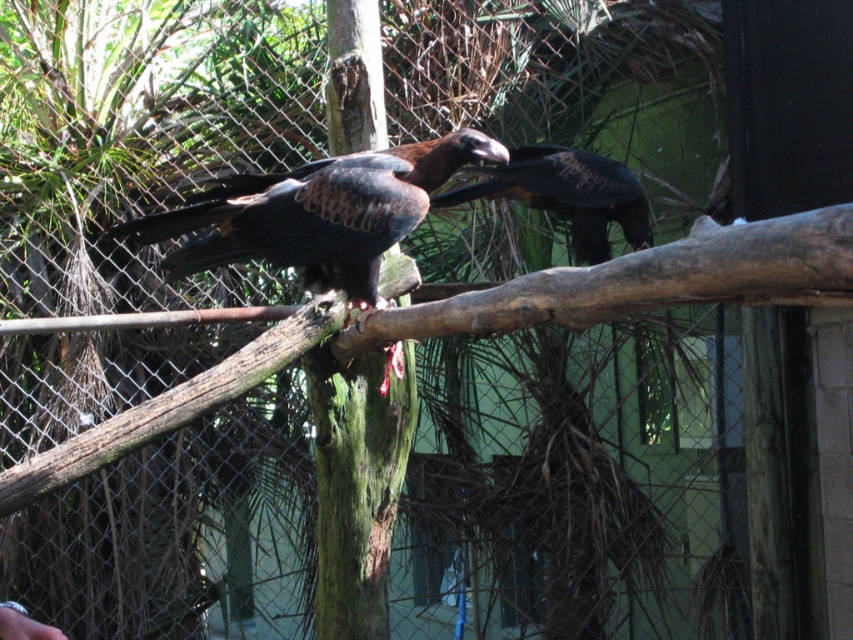
Question: Which object is farther from the camera taking this photo?

Choices:
 (A) brown rough wood at center
 (B) shiny dark brown eagle at center
 (C) dark brown feathers at center

Answer: (B)

Question: Which point is farther from the camera taking this photo?

Choices:
 (A) (508, 189)
 (B) (314, 320)
 (C) (263, 204)

Answer: (A)

Question: Considering the relative positions of brown rough wood at center and shiny dark brown eagle at center in the image provided, where is brown rough wood at center located with respect to shiny dark brown eagle at center?

Choices:
 (A) above
 (B) below

Answer: (B)

Question: Which point is closer to the camera?

Choices:
 (A) brown rough wood at center
 (B) shiny dark brown eagle at center
 (C) dark brown feathers at center

Answer: (A)

Question: Can you confirm if brown rough wood at center is bigger than dark brown feathers at center?

Choices:
 (A) no
 (B) yes

Answer: (B)

Question: Is the position of brown rough wood at center less distant than that of dark brown feathers at center?

Choices:
 (A) no
 (B) yes

Answer: (B)